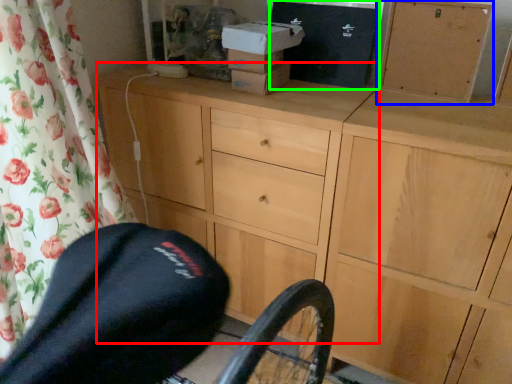
Question: Which object is the closest to the chest of drawers (highlighted by a red box)? Choose among these: cabinetry (highlighted by a blue box) or box (highlighted by a green box).

Choices:
 (A) cabinetry
 (B) box

Answer: (B)